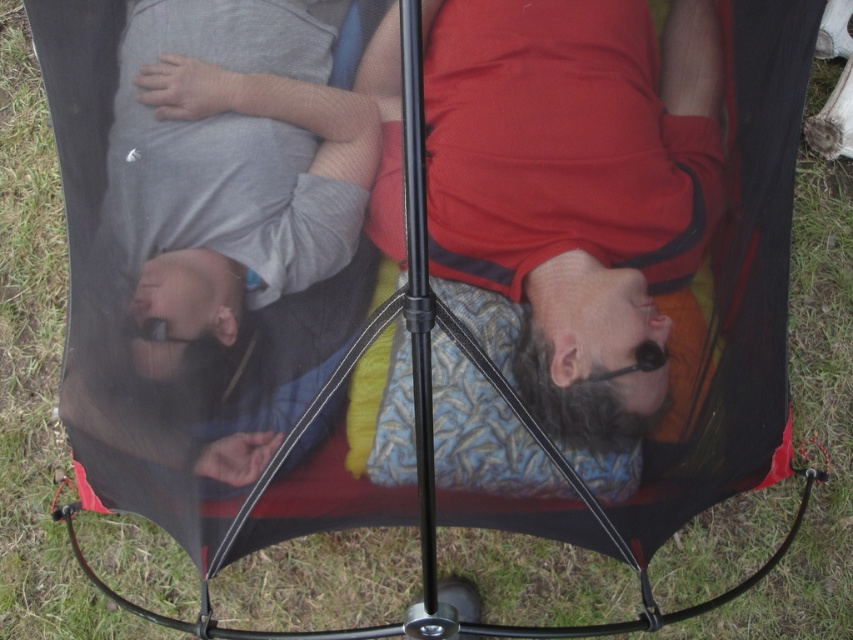
You are a photographer standing outside the black mesh tent. You want to take a photo that includes both the matte red shirt at center and the gray cotton shirt at upper left. Given that your camera has a maximum focus range of 30 centimeters, will you be able to capture both subjects clearly in the same frame?

The distance between the matte red shirt at center and the gray cotton shirt at upper left is 31.57 centimeters. Since this exceeds the camera maximum focus range of 30 centimeters, you will not be able to capture both subjects clearly in the same frame.

You are standing at the center of the image and want to locate the matte red shirt at center. Which direction should you look to find it?

The matte red shirt at center is located at point coordinates (x=575, y=186). Since you are at the center of the image, you should look slightly to the left and downward to find the matte red shirt at center.